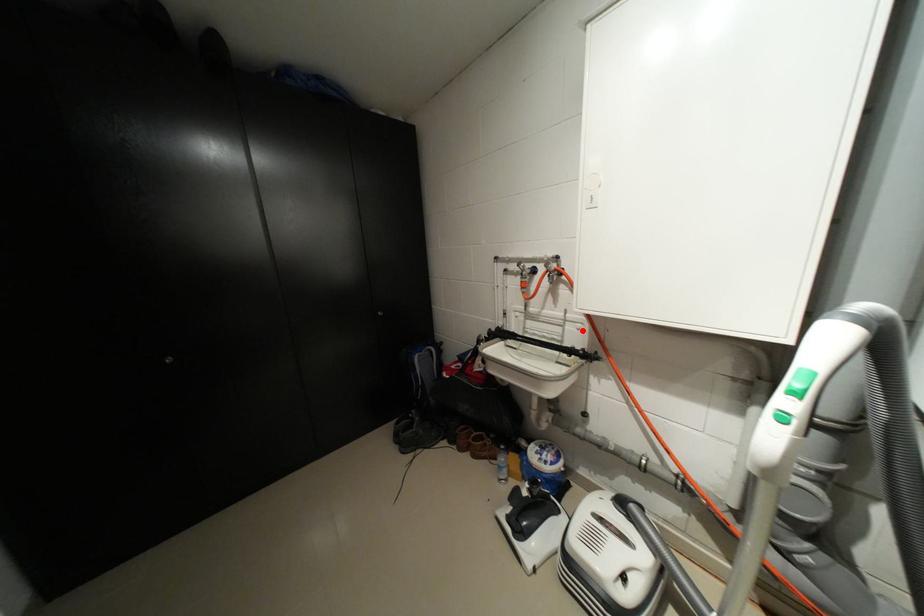
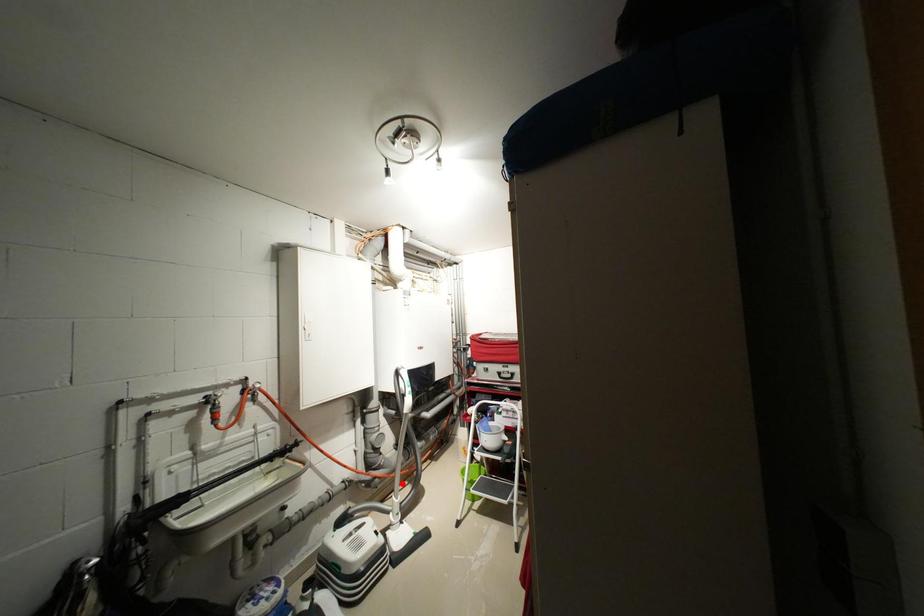
I am providing you with two images of the same scene from different viewpoints. A red point is marked on the first image and another point is marked on the second image. Does the point marked in image1 correspond to the same location as the one in image2?

No